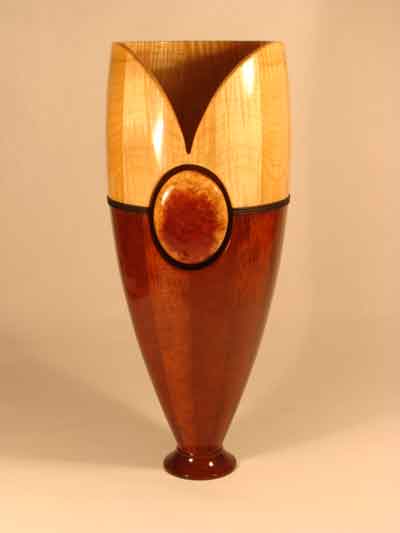
Find the location of a particular element. The width and height of the screenshot is (400, 533). light wood top is located at coordinates (237, 151).